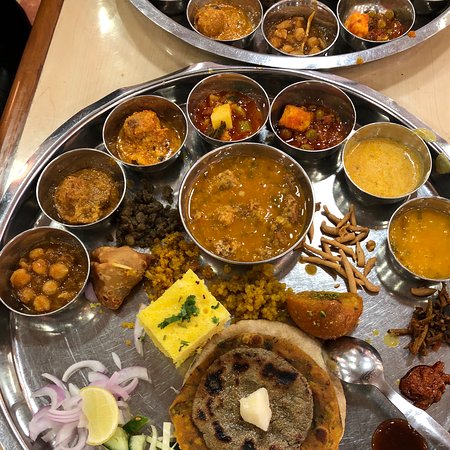
The image size is (450, 450). In order to click on food bowls in this screenshot , I will do `click(75, 239)`, `click(115, 202)`, `click(167, 152)`, `click(222, 139)`, `click(319, 146)`, `click(407, 268)`, `click(359, 187)`.